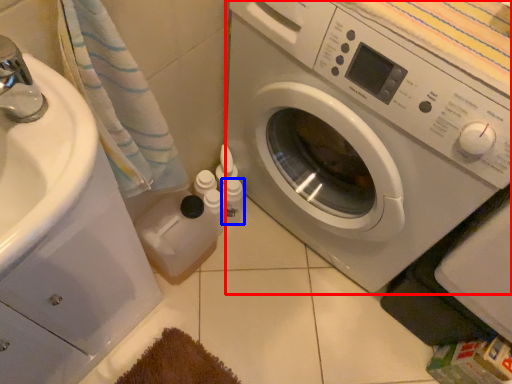
Question: Which point is closer to the camera, washing machine (highlighted by a red box) or toiletry (highlighted by a blue box)?

Choices:
 (A) washing machine
 (B) toiletry

Answer: (A)